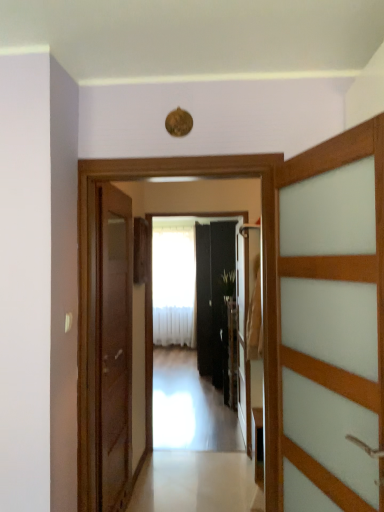
Question: Is white sheer curtain at center bigger than black glossy door at center, which is the 3th door from left to right?

Choices:
 (A) yes
 (B) no

Answer: (A)

Question: Is white sheer curtain at center aimed at black glossy door at center, arranged as the 1th door when viewed from the right?

Choices:
 (A) no
 (B) yes

Answer: (A)

Question: From a real-world perspective, is white sheer curtain at center over black glossy door at center, which is the third door in front-to-back order?

Choices:
 (A) yes
 (B) no

Answer: (A)

Question: Does white sheer curtain at center lie in front of black glossy door at center, which is the 3th door from left to right?

Choices:
 (A) yes
 (B) no

Answer: (B)

Question: Is white sheer curtain at center looking in the opposite direction of black glossy door at center, which is the 3th door from left to right?

Choices:
 (A) yes
 (B) no

Answer: (B)

Question: Is white sheer curtain at center positioned behind black glossy door at center, the 1th door viewed from the back?

Choices:
 (A) no
 (B) yes

Answer: (B)

Question: Is transparent glass elevator at center touching green leafy plant at center?

Choices:
 (A) yes
 (B) no

Answer: (B)

Question: Can you confirm if transparent glass elevator at center is thinner than green leafy plant at center?

Choices:
 (A) no
 (B) yes

Answer: (B)

Question: Is transparent glass elevator at center positioned in front of green leafy plant at center?

Choices:
 (A) yes
 (B) no

Answer: (A)

Question: Is transparent glass elevator at center positioned behind green leafy plant at center?

Choices:
 (A) yes
 (B) no

Answer: (B)

Question: Does transparent glass elevator at center have a larger size compared to green leafy plant at center?

Choices:
 (A) yes
 (B) no

Answer: (A)

Question: Is transparent glass elevator at center not inside green leafy plant at center?

Choices:
 (A) yes
 (B) no

Answer: (A)

Question: Can we say transparent glass elevator at center lies outside wooden door at left, positioned as the 2th door in front-to-back order?

Choices:
 (A) no
 (B) yes

Answer: (B)